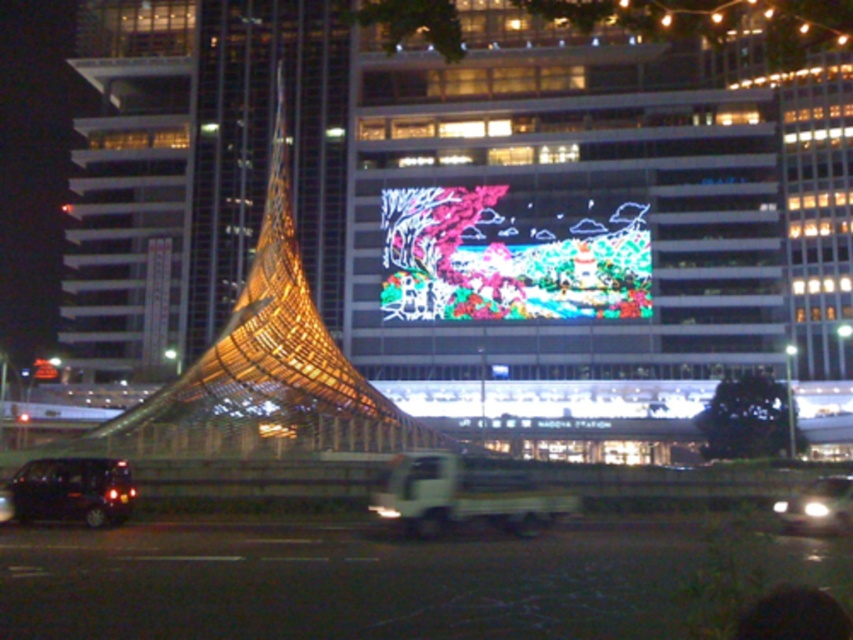
From the picture: Is the position of glassy reflective tower at left less distant than that of shiny silver car at lower right?

No, glassy reflective tower at left is behind shiny silver car at lower right.

Which is behind, point (134, 253) or point (824, 524)?

The point (134, 253) is more distant.

Where is `glassy reflective tower at left`? This screenshot has width=853, height=640. glassy reflective tower at left is located at coordinates (131, 189).

Is glassy reflective tower at left closer to camera compared to black rubber car at lower left?

That is False.

Between point (77, 250) and point (3, 500), which one is positioned behind?

Point (77, 250)

The image size is (853, 640). Describe the element at coordinates (131, 189) in the screenshot. I see `glassy reflective tower at left` at that location.

You are a GUI agent. You are given a task and a screenshot of the screen. Output one action in this format:
    pyautogui.click(x=<x>, y=<y>)
    Task: Click on the glassy reflective tower at left
    The height and width of the screenshot is (640, 853).
    Given the screenshot: What is the action you would take?
    pyautogui.click(x=131, y=189)

Can you confirm if shiny black car at lower left is positioned to the right of shiny silver car at lower right?

No, shiny black car at lower left is not to the right of shiny silver car at lower right.

Which is above, shiny black car at lower left or shiny silver car at lower right?

shiny black car at lower left is higher up.

Where is `shiny black car at lower left`? shiny black car at lower left is located at coordinates (73, 490).